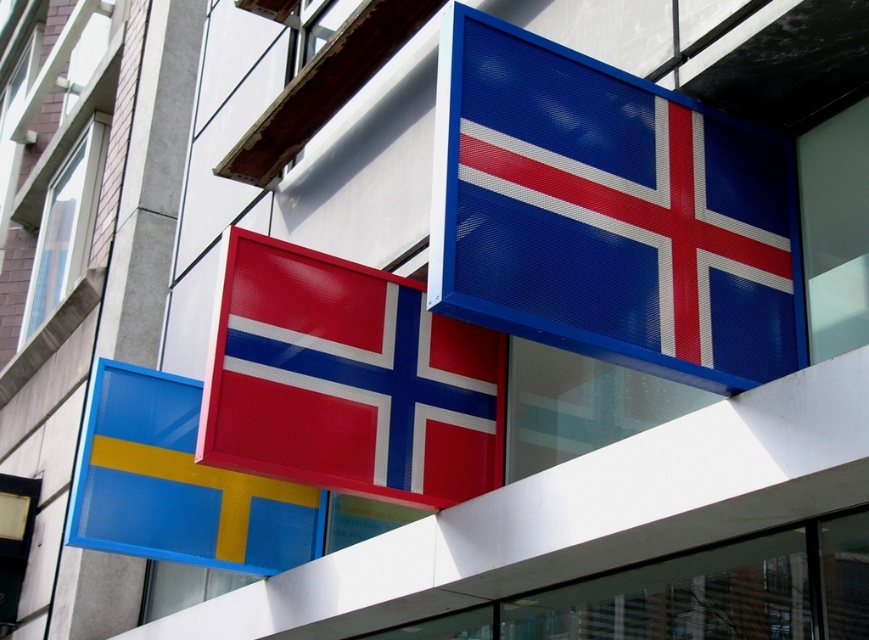
Question: Which point is closer to the camera?

Choices:
 (A) (673, 324)
 (B) (368, 288)

Answer: (A)

Question: Does metallic red flag at center have a greater width compared to matte plastic flag at lower left?

Choices:
 (A) yes
 (B) no

Answer: (B)

Question: Where is blue mesh flag at upper right located in relation to matte plastic flag at lower left in the image?

Choices:
 (A) right
 (B) left

Answer: (A)

Question: Considering the real-world distances, which object is closest to the matte plastic flag at lower left?

Choices:
 (A) metallic red flag at center
 (B) blue mesh flag at upper right

Answer: (A)

Question: Which of the following is the farthest from the observer?

Choices:
 (A) (177, 541)
 (B) (474, 464)

Answer: (A)

Question: Considering the relative positions of blue mesh flag at upper right and metallic red flag at center in the image provided, where is blue mesh flag at upper right located with respect to metallic red flag at center?

Choices:
 (A) below
 (B) above

Answer: (B)